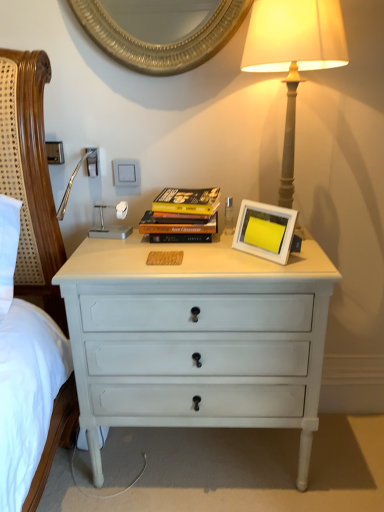
Question: From a real-world perspective, is hardcover books at center positioned over matte gray lamp at upper right based on gravity?

Choices:
 (A) yes
 (B) no

Answer: (B)

Question: Is hardcover books at center facing away from matte gray lamp at upper right?

Choices:
 (A) yes
 (B) no

Answer: (B)

Question: Would you consider hardcover books at center to be distant from matte gray lamp at upper right?

Choices:
 (A) yes
 (B) no

Answer: (B)

Question: From a real-world perspective, is hardcover books at center under matte gray lamp at upper right?

Choices:
 (A) no
 (B) yes

Answer: (B)

Question: From the image's perspective, is hardcover books at center on matte gray lamp at upper right?

Choices:
 (A) no
 (B) yes

Answer: (A)

Question: Does hardcover books at center appear on the left side of matte gray lamp at upper right?

Choices:
 (A) yes
 (B) no

Answer: (A)

Question: Is matte gray lamp at upper right at the left side of hardcover books at center?

Choices:
 (A) no
 (B) yes

Answer: (A)

Question: Does matte gray lamp at upper right have a lesser width compared to hardcover books at center?

Choices:
 (A) yes
 (B) no

Answer: (B)

Question: Can you confirm if matte gray lamp at upper right is shorter than hardcover books at center?

Choices:
 (A) yes
 (B) no

Answer: (B)

Question: From a real-world perspective, is matte gray lamp at upper right over hardcover books at center?

Choices:
 (A) yes
 (B) no

Answer: (A)

Question: Is matte gray lamp at upper right not close to hardcover books at center?

Choices:
 (A) no
 (B) yes

Answer: (A)

Question: Is matte gray lamp at upper right completely or partially outside of hardcover books at center?

Choices:
 (A) no
 (B) yes

Answer: (B)

Question: Considering the relative positions of hardcover books at center and white painted wood chest of drawers at center in the image provided, is hardcover books at center to the right of white painted wood chest of drawers at center from the viewer's perspective?

Choices:
 (A) no
 (B) yes

Answer: (A)